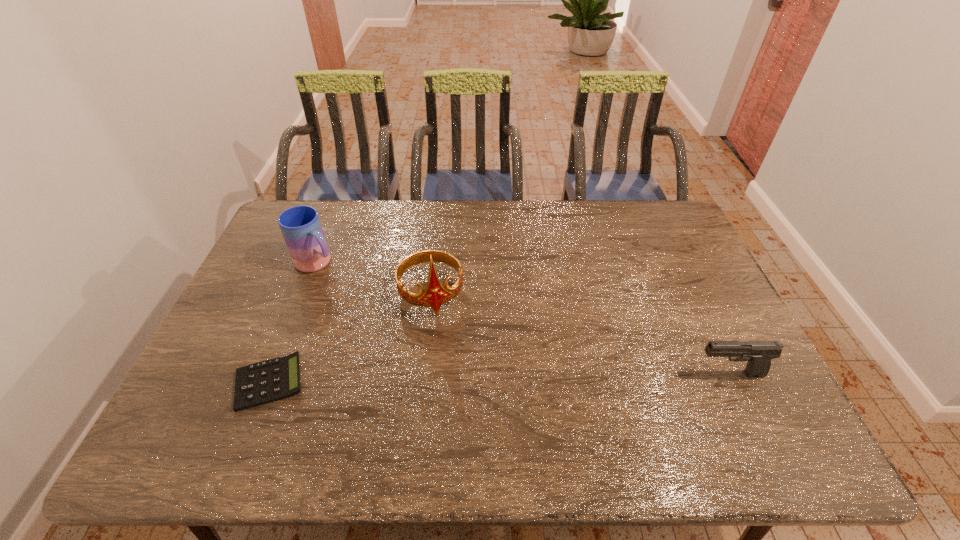
The width and height of the screenshot is (960, 540). What are the coordinates of `free spot that satisfies the following two spatial constraints: 1. on the back side of the calculator; 2. aim along the barrel of the pistol` in the screenshot? It's located at (273, 374).

This screenshot has height=540, width=960. I want to click on vacant region that satisfies the following two spatial constraints: 1. on the front side of the second object from right to left; 2. aim along the barrel of the third tallest object, so click(422, 374).

Where is `free space that satisfies the following two spatial constraints: 1. on the back side of the shortest object; 2. aim along the barrel of the rightmost object`? The height and width of the screenshot is (540, 960). free space that satisfies the following two spatial constraints: 1. on the back side of the shortest object; 2. aim along the barrel of the rightmost object is located at coordinates (273, 374).

Where is `free location that satisfies the following two spatial constraints: 1. on the back side of the shortest object; 2. on the right side of the tiara`? This screenshot has height=540, width=960. free location that satisfies the following two spatial constraints: 1. on the back side of the shortest object; 2. on the right side of the tiara is located at coordinates (304, 294).

Where is `vacant region that satisfies the following two spatial constraints: 1. on the back side of the rightmost object; 2. aim along the barrel of the calculator`? The image size is (960, 540). vacant region that satisfies the following two spatial constraints: 1. on the back side of the rightmost object; 2. aim along the barrel of the calculator is located at coordinates (273, 374).